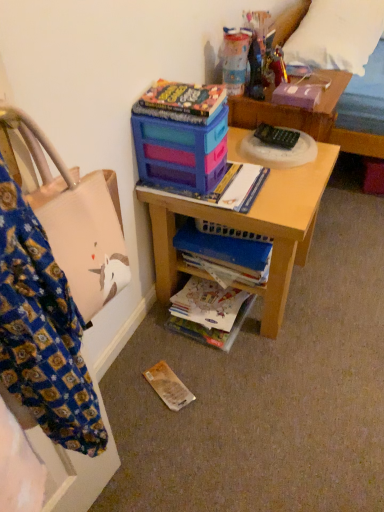
The image size is (384, 512). Find the location of `vacant area that lies to the right of wooden desk at center`. vacant area that lies to the right of wooden desk at center is located at coordinates (337, 278).